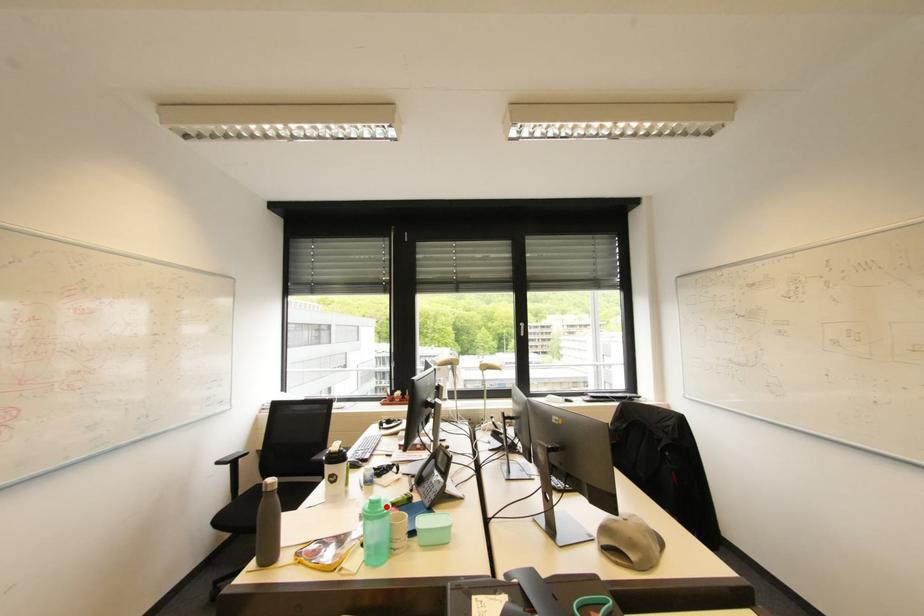
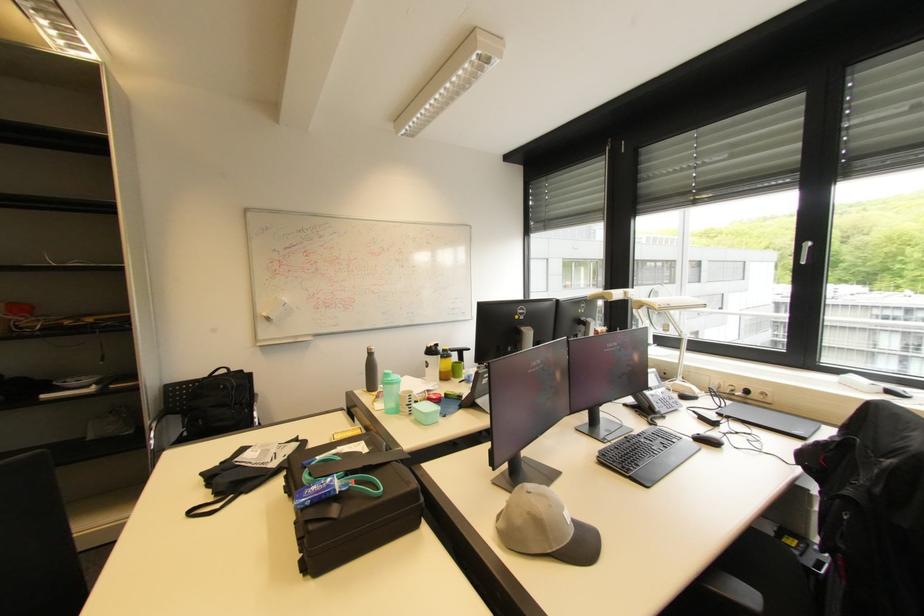
Question: I am providing you with two images of the same scene from different viewpoints. Given a red point in image1, look at the same physical point in image2. Is it:

Choices:
 (A) Closer to the viewpoint
 (B) Farther from the viewpoint

Answer: (B)